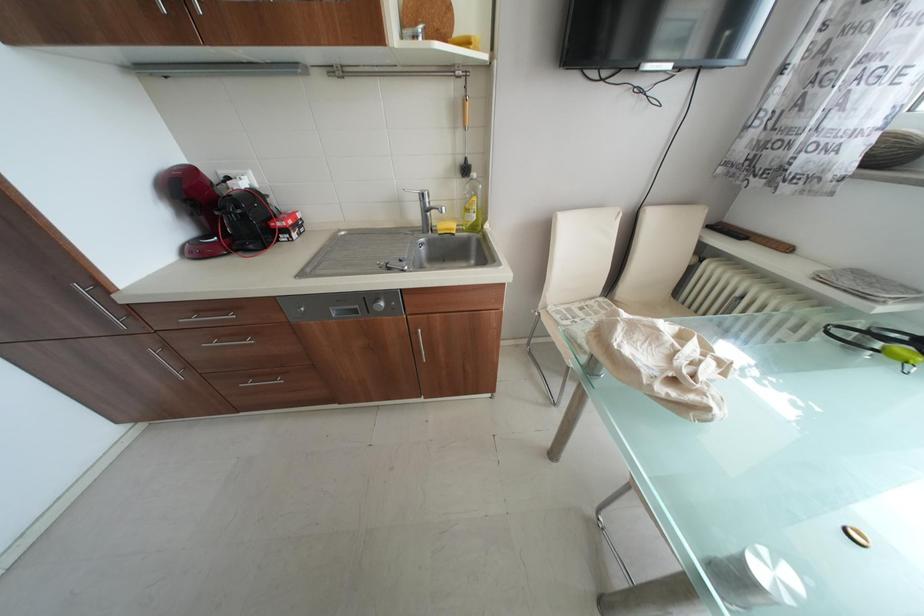
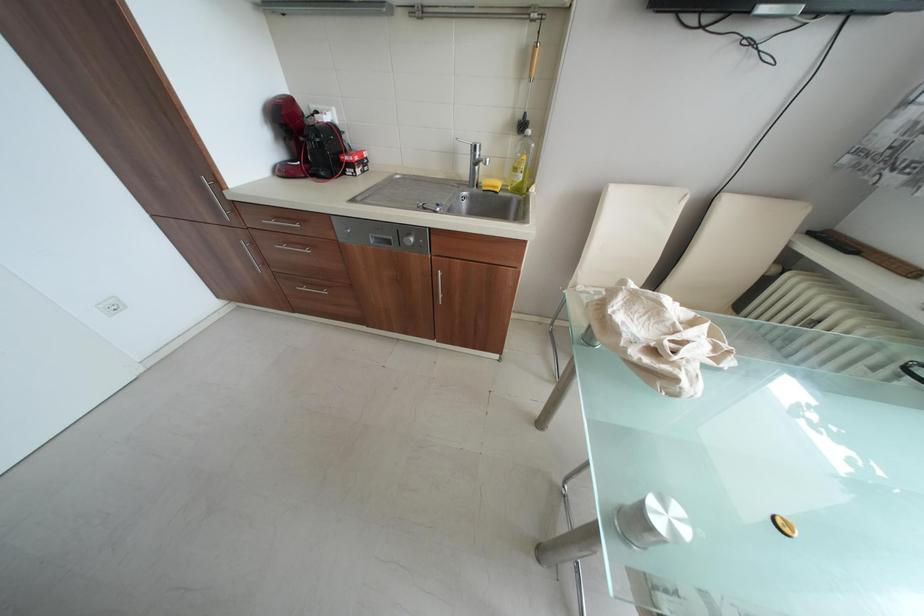
Question: In a continuous first-person perspective shot, in which direction is the camera moving?

Choices:
 (A) Left
 (B) Right
 (C) Forward
 (D) Backward

Answer: (B)